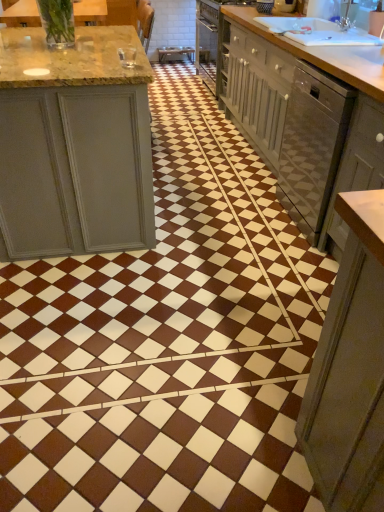
Identify the location of white glossy dishwasher at right. (312, 145).

Describe the element at coordinates (356, 166) in the screenshot. This screenshot has height=512, width=384. I see `matte gray cabinet at right` at that location.

You are a GUI agent. You are given a task and a screenshot of the screen. Output one action in this format:
    pyautogui.click(x=<x>, y=<y>)
    Task: Click on the white glossy dishwasher at right
    Image resolution: width=384 pixels, height=512 pixels.
    Given the screenshot: What is the action you would take?
    pyautogui.click(x=312, y=145)

From a real-world perspective, who is located lower, matte gray cabinet at right or translucent glass vase at upper left, which is the 1th countertop from front to back?

matte gray cabinet at right, from a real-world perspective.

The width and height of the screenshot is (384, 512). I want to click on the 1st countertop behind the matte gray cabinet at right, so click(x=22, y=14).

Consider the image. Does matte gray cabinet at right lie in front of translucent glass vase at upper left, which appears as the 2th countertop when viewed from the back?

Yes, it is in front of translucent glass vase at upper left, which appears as the 2th countertop when viewed from the back.

At what (x,y) coordinates should I click in order to perform the action: click on the 2nd countertop above when counting from the matte gray cabinet at right (from the image's perspective). Please return your answer as a coordinate pair (x, y). Image resolution: width=384 pixels, height=512 pixels. Looking at the image, I should click on (306, 119).

From the image's perspective, which object appears higher, matte gray cabinet at right or light brown wood countertop at upper right, acting as the first countertop starting from the right?

From the image's view, light brown wood countertop at upper right, acting as the first countertop starting from the right, is above.

From a real-world perspective, which is physically above, matte gray cabinet at right or light brown wood countertop at upper right, acting as the 2th countertop starting from the left?

matte gray cabinet at right.

Does matte gray cabinet at right have a lesser height compared to light brown wood countertop at upper right, which is the 1th countertop from back to front?

Correct, matte gray cabinet at right is not as tall as light brown wood countertop at upper right, which is the 1th countertop from back to front.

From the image's perspective, who appears lower, light brown wood countertop at upper right, which is the 1th countertop from back to front, or matte gray cabinet at right?

From the image's view, matte gray cabinet at right is below.

Between light brown wood countertop at upper right, which is the 1th countertop from back to front, and matte gray cabinet at right, which one has more height?

light brown wood countertop at upper right, which is the 1th countertop from back to front, is taller.

Between light brown wood countertop at upper right, which is the 1th countertop from back to front, and matte gray cabinet at right, which one appears on the left side from the viewer's perspective?

From the viewer's perspective, light brown wood countertop at upper right, which is the 1th countertop from back to front, appears more on the left side.

Is light brown wood countertop at upper right, acting as the 2th countertop starting from the left, bigger than matte gray cabinet at right?

Indeed, light brown wood countertop at upper right, acting as the 2th countertop starting from the left, has a larger size compared to matte gray cabinet at right.

Can you tell me how much light brown wood countertop at upper right, acting as the 2th countertop starting from the left, and translucent glass vase at upper left, which is the 1th countertop from front to back, differ in facing direction?

178 degrees.

Considering the positions of objects light brown wood countertop at upper right, acting as the first countertop starting from the right, and translucent glass vase at upper left, which is counted as the first countertop, starting from the left, in the image provided, who is more to the left, light brown wood countertop at upper right, acting as the first countertop starting from the right, or translucent glass vase at upper left, which is counted as the first countertop, starting from the left,?

Positioned to the left is translucent glass vase at upper left, which is counted as the first countertop, starting from the left.

Which is in front, point (261, 152) or point (38, 12)?

The point (38, 12) is in front.

Considering the relative positions of light brown wood countertop at upper right, acting as the 2th countertop starting from the left, and translucent glass vase at upper left, which is counted as the first countertop, starting from the left, in the image provided, is light brown wood countertop at upper right, acting as the 2th countertop starting from the left, behind translucent glass vase at upper left, which is counted as the first countertop, starting from the left,?

That is True.

Where is `the 2nd countertop to the left when counting from the white glossy dishwasher at right`? the 2nd countertop to the left when counting from the white glossy dishwasher at right is located at coordinates (22, 14).

In the scene shown: From a real-world perspective, who is located higher, translucent glass vase at upper left, which is the 1th countertop from front to back, or white glossy dishwasher at right?

In real-world perspective, translucent glass vase at upper left, which is the 1th countertop from front to back, is above.

From the image's perspective, is translucent glass vase at upper left, which appears as the 2th countertop when viewed from the back, beneath white glossy dishwasher at right?

Actually, translucent glass vase at upper left, which appears as the 2th countertop when viewed from the back, appears above white glossy dishwasher at right in the image.

Is white glossy dishwasher at right directly adjacent to matte gray cabinet at right?

white glossy dishwasher at right and matte gray cabinet at right are clearly separated.

Based on the photo, between white glossy dishwasher at right and matte gray cabinet at right, which one appears on the right side from the viewer's perspective?

white glossy dishwasher at right.

Considering the relative sizes of white glossy dishwasher at right and matte gray cabinet at right in the image provided, is white glossy dishwasher at right taller than matte gray cabinet at right?

Indeed, white glossy dishwasher at right has a greater height compared to matte gray cabinet at right.

From a real-world perspective, is white glossy dishwasher at right physically above matte gray cabinet at right?

Actually, white glossy dishwasher at right is physically below matte gray cabinet at right in the real world.

Would you say matte gray cabinet at right is a long distance from white glossy dishwasher at right?

matte gray cabinet at right is near white glossy dishwasher at right, not far away.

Considering the sizes of objects matte gray cabinet at right and white glossy dishwasher at right in the image provided, who is thinner, matte gray cabinet at right or white glossy dishwasher at right?

matte gray cabinet at right.

Would you say white glossy dishwasher at right is part of matte gray cabinet at right's contents?

No.

At what (x,y) coordinates should I click in order to perform the action: click on dish washer below the matte gray cabinet at right (from a real-world perspective). Please return your answer as a coordinate pair (x, y). Looking at the image, I should click on (312, 145).

Locate an element on the screen. This screenshot has height=512, width=384. cabinetry in front of the translucent glass vase at upper left, arranged as the 2th countertop when viewed from the right is located at coordinates (356, 166).

Find the location of a particular element. This screenshot has width=384, height=512. the 1st countertop to the left of the matte gray cabinet at right, starting your count from the anchor is located at coordinates (306, 119).

Based on their spatial positions, is white glossy dishwasher at right or light brown wood countertop at upper right, acting as the first countertop starting from the right, further from matte gray cabinet at right?

Based on the image, light brown wood countertop at upper right, acting as the first countertop starting from the right, appears to be further to matte gray cabinet at right.

Estimate the real-world distances between objects in this image. Which object is closer to white glossy dishwasher at right, light brown wood countertop at upper right, acting as the first countertop starting from the right, or translucent glass vase at upper left, arranged as the 2th countertop when viewed from the right?

light brown wood countertop at upper right, acting as the first countertop starting from the right, lies closer to white glossy dishwasher at right than the other object.

Looking at the image, which one is located further to matte gray cabinet at right, light brown wood countertop at upper right, acting as the 2th countertop starting from the left, or translucent glass vase at upper left, which appears as the 2th countertop when viewed from the back?

translucent glass vase at upper left, which appears as the 2th countertop when viewed from the back, is further to matte gray cabinet at right.

When comparing their distances from light brown wood countertop at upper right, acting as the first countertop starting from the right, does white glossy dishwasher at right or translucent glass vase at upper left, which is counted as the first countertop, starting from the left, seem further?

Among the two, translucent glass vase at upper left, which is counted as the first countertop, starting from the left, is located further to light brown wood countertop at upper right, acting as the first countertop starting from the right.

Estimate the real-world distances between objects in this image. Which object is closer to translucent glass vase at upper left, which is the 1th countertop from front to back, white glossy dishwasher at right or light brown wood countertop at upper right, acting as the 2th countertop starting from the left?

light brown wood countertop at upper right, acting as the 2th countertop starting from the left, is closer to translucent glass vase at upper left, which is the 1th countertop from front to back.

Estimate the real-world distances between objects in this image. Which object is closer to translucent glass vase at upper left, which is counted as the first countertop, starting from the left, light brown wood countertop at upper right, which appears as the 2th countertop when viewed from the front, or matte gray cabinet at right?

light brown wood countertop at upper right, which appears as the 2th countertop when viewed from the front, lies closer to translucent glass vase at upper left, which is counted as the first countertop, starting from the left, than the other object.

From the image, which object appears to be farther from light brown wood countertop at upper right, which appears as the 2th countertop when viewed from the front, translucent glass vase at upper left, which is counted as the first countertop, starting from the left, or matte gray cabinet at right?

The object further to light brown wood countertop at upper right, which appears as the 2th countertop when viewed from the front, is translucent glass vase at upper left, which is counted as the first countertop, starting from the left.

Considering their positions, is matte gray cabinet at right positioned closer to translucent glass vase at upper left, which is counted as the first countertop, starting from the left, than light brown wood countertop at upper right, which is the 1th countertop from back to front?

light brown wood countertop at upper right, which is the 1th countertop from back to front, lies closer to translucent glass vase at upper left, which is counted as the first countertop, starting from the left, than the other object.

This screenshot has width=384, height=512. Identify the location of countertop between translucent glass vase at upper left, which appears as the 2th countertop when viewed from the back, and white glossy dishwasher at right. (306, 119).

This screenshot has width=384, height=512. In order to click on cabinetry between translucent glass vase at upper left, arranged as the 2th countertop when viewed from the right, and white glossy dishwasher at right in this screenshot , I will do `click(356, 166)`.

Identify the location of dish washer between light brown wood countertop at upper right, acting as the first countertop starting from the right, and matte gray cabinet at right from top to bottom. The width and height of the screenshot is (384, 512). pyautogui.click(x=312, y=145).

The height and width of the screenshot is (512, 384). I want to click on countertop between translucent glass vase at upper left, which is counted as the first countertop, starting from the left, and matte gray cabinet at right, so click(306, 119).